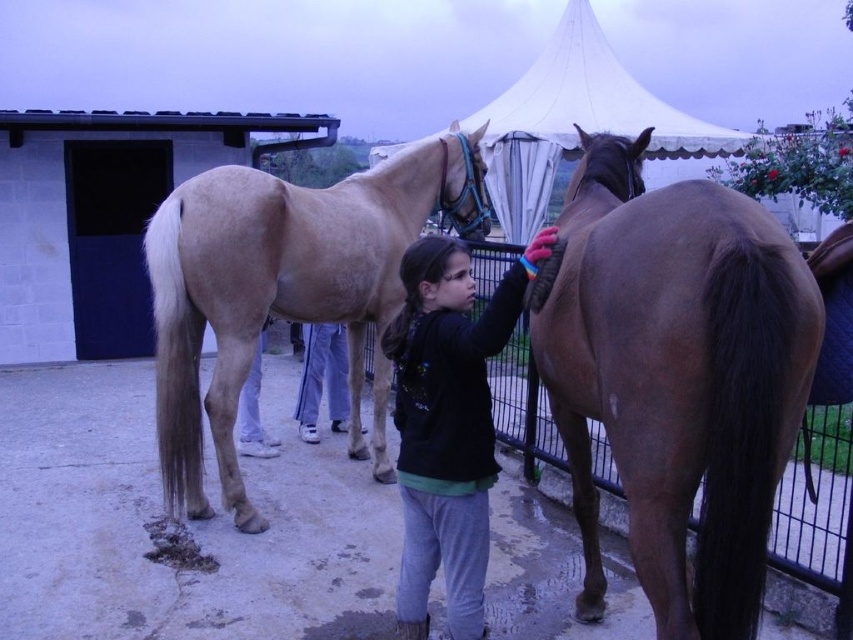
Who is more distant from viewer, (479, 545) or (248, 417)?

Point (248, 417)

Looking at this image, is black fleece jacket at center thinner than white fabric pants at lower center?

No, black fleece jacket at center is not thinner than white fabric pants at lower center.

Is point (469, 536) closer to camera compared to point (257, 365)?

Yes, it is.

Where is `black fleece jacket at center`? Image resolution: width=853 pixels, height=640 pixels. black fleece jacket at center is located at coordinates (448, 424).

Can you confirm if brown matte horse at right is shorter than white cotton pants at center?

In fact, brown matte horse at right may be taller than white cotton pants at center.

Is brown matte horse at right below white cotton pants at center?

Actually, brown matte horse at right is above white cotton pants at center.

Image resolution: width=853 pixels, height=640 pixels. What are the coordinates of `brown matte horse at right` in the screenshot? It's located at click(676, 378).

Can you confirm if light brown glossy horse at center is positioned to the right of white cotton pants at center?

Yes, light brown glossy horse at center is to the right of white cotton pants at center.

Does light brown glossy horse at center have a greater height compared to white cotton pants at center?

Yes.

Is point (469, 141) closer to camera compared to point (305, 362)?

That is True.

At what (x,y) coordinates should I click in order to perform the action: click on light brown glossy horse at center. Please return your answer as a coordinate pair (x, y). Looking at the image, I should click on (285, 291).